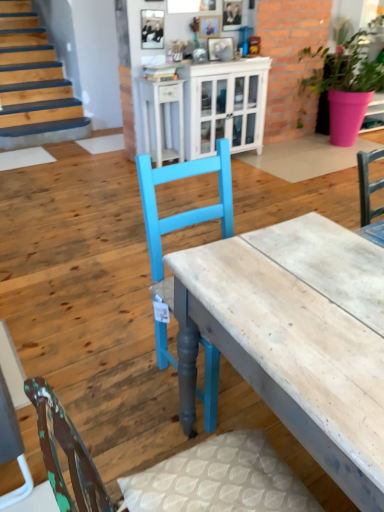
Question: Can you confirm if white glossy cabinet at upper center is positioned to the right of white glossy cabinet at upper center?

Choices:
 (A) no
 (B) yes

Answer: (A)

Question: From the image's perspective, is white glossy cabinet at upper center located above white glossy cabinet at upper center?

Choices:
 (A) yes
 (B) no

Answer: (B)

Question: Is white glossy cabinet at upper center far from white glossy cabinet at upper center?

Choices:
 (A) yes
 (B) no

Answer: (B)

Question: From a real-world perspective, is white glossy cabinet at upper center positioned over white glossy cabinet at upper center based on gravity?

Choices:
 (A) no
 (B) yes

Answer: (A)

Question: Considering the relative sizes of white glossy cabinet at upper center and white glossy cabinet at upper center in the image provided, is white glossy cabinet at upper center taller than white glossy cabinet at upper center?

Choices:
 (A) no
 (B) yes

Answer: (A)

Question: Looking at their shapes, would you say pink matte pot at upper right is wider or thinner than white glossy cabinet at upper center?

Choices:
 (A) thin
 (B) wide

Answer: (B)

Question: Visually, is pink matte pot at upper right positioned to the left or to the right of white glossy cabinet at upper center?

Choices:
 (A) right
 (B) left

Answer: (A)

Question: From a real-world perspective, is pink matte pot at upper right positioned above or below white glossy cabinet at upper center?

Choices:
 (A) below
 (B) above

Answer: (B)

Question: From the image's perspective, is pink matte pot at upper right positioned above or below white glossy cabinet at upper center?

Choices:
 (A) above
 (B) below

Answer: (A)

Question: From the image's perspective, is wooden desk at center above or below white glossy cabinet at upper center?

Choices:
 (A) above
 (B) below

Answer: (B)

Question: Considering the positions of wooden desk at center and white glossy cabinet at upper center in the image, is wooden desk at center taller or shorter than white glossy cabinet at upper center?

Choices:
 (A) tall
 (B) short

Answer: (B)

Question: Looking at their shapes, would you say wooden desk at center is wider or thinner than white glossy cabinet at upper center?

Choices:
 (A) thin
 (B) wide

Answer: (B)

Question: Considering the positions of point (188, 300) and point (225, 131), is point (188, 300) closer or farther from the camera than point (225, 131)?

Choices:
 (A) farther
 (B) closer

Answer: (B)

Question: From a real-world perspective, relative to white glossy cabinet at upper center, is wooden desk at center vertically above or below?

Choices:
 (A) below
 (B) above

Answer: (A)

Question: Is wooden desk at center bigger or smaller than white glossy cabinet at upper center?

Choices:
 (A) big
 (B) small

Answer: (A)